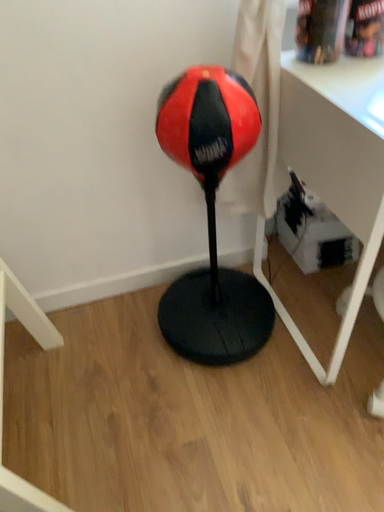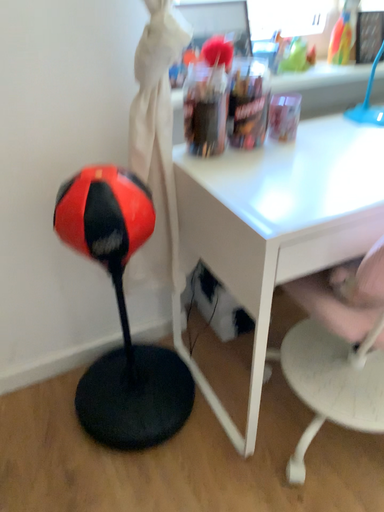
Question: How did the camera likely rotate when shooting the video?

Choices:
 (A) rotated downward
 (B) rotated upward

Answer: (B)